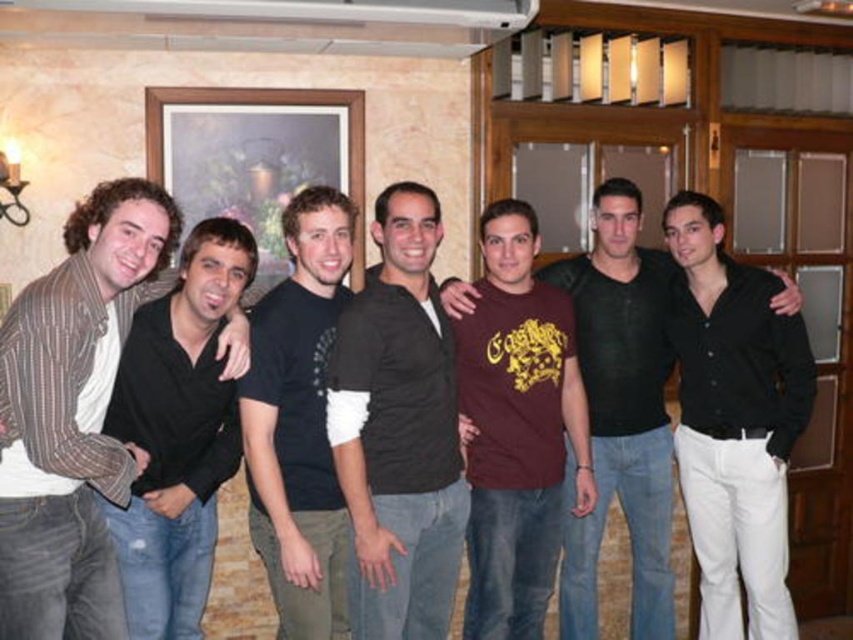
Who is more forward, (679, 330) or (538, 308)?

Positioned in front is point (538, 308).

Looking at this image, who is more distant from viewer, (782, 376) or (508, 211)?

The point (782, 376) is more distant.

The image size is (853, 640). I want to click on black matte shirt at center, so click(735, 422).

Does striped wool sweater at left have a lesser height compared to maroon cotton t-shirt at center?

Correct, striped wool sweater at left is not as tall as maroon cotton t-shirt at center.

Between point (22, 608) and point (607, 468), which one is positioned behind?

Positioned behind is point (607, 468).

Image resolution: width=853 pixels, height=640 pixels. In order to click on striped wool sweater at left in this screenshot , I will do `click(74, 413)`.

Who is higher up, striped wool sweater at left or maroon jersey at center?

Positioned higher is striped wool sweater at left.

Who is shorter, striped wool sweater at left or maroon jersey at center?

With less height is striped wool sweater at left.

I want to click on striped wool sweater at left, so click(x=74, y=413).